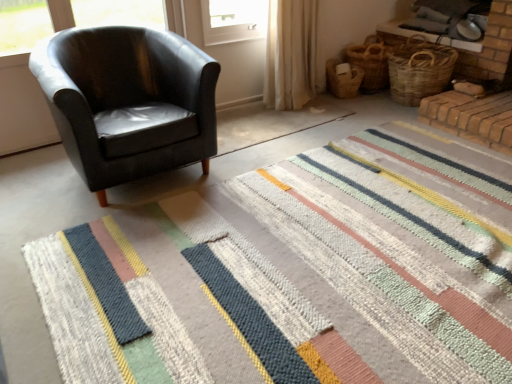
Question: Are woven brown basket at upper right, the 1th basket in the right-to-left sequence, and beige fabric curtain at upper center located far from each other?

Choices:
 (A) no
 (B) yes

Answer: (A)

Question: Is woven brown basket at upper right, marked as the third basket in a left-to-right arrangement, with beige fabric curtain at upper center?

Choices:
 (A) no
 (B) yes

Answer: (A)

Question: Is the position of woven brown basket at upper right, the 1th basket in the right-to-left sequence, less distant than that of beige fabric curtain at upper center?

Choices:
 (A) yes
 (B) no

Answer: (B)

Question: Would you say woven brown basket at upper right, the 1th basket in the right-to-left sequence, is outside beige fabric curtain at upper center?

Choices:
 (A) no
 (B) yes

Answer: (B)

Question: From a real-world perspective, is woven brown basket at upper right, marked as the third basket in a left-to-right arrangement, positioned under beige fabric curtain at upper center based on gravity?

Choices:
 (A) yes
 (B) no

Answer: (A)

Question: From a real-world perspective, is beige fabric curtain at upper center positioned above or below matte black armchair at left?

Choices:
 (A) below
 (B) above

Answer: (B)

Question: Relative to matte black armchair at left, is beige fabric curtain at upper center in front or behind?

Choices:
 (A) behind
 (B) front

Answer: (A)

Question: Is beige fabric curtain at upper center spatially inside matte black armchair at left, or outside of it?

Choices:
 (A) outside
 (B) inside

Answer: (A)

Question: Considering the positions of beige fabric curtain at upper center and matte black armchair at left in the image, is beige fabric curtain at upper center wider or thinner than matte black armchair at left?

Choices:
 (A) thin
 (B) wide

Answer: (A)

Question: From a real-world perspective, is beige fabric curtain at upper center positioned above or below striped woolen rug at center?

Choices:
 (A) below
 (B) above

Answer: (B)

Question: Is beige fabric curtain at upper center taller or shorter than striped woolen rug at center?

Choices:
 (A) tall
 (B) short

Answer: (A)

Question: From the image's perspective, relative to striped woolen rug at center, is beige fabric curtain at upper center above or below?

Choices:
 (A) above
 (B) below

Answer: (A)

Question: Is point (309, 67) positioned closer to the camera than point (444, 314)?

Choices:
 (A) farther
 (B) closer

Answer: (A)

Question: From a real-world perspective, is woven straw basket at right, which is counted as the 1th basket, starting from the left, physically located above or below beige fabric curtain at upper center?

Choices:
 (A) below
 (B) above

Answer: (A)

Question: Does point (338, 69) appear closer or farther from the camera than point (288, 67)?

Choices:
 (A) farther
 (B) closer

Answer: (A)